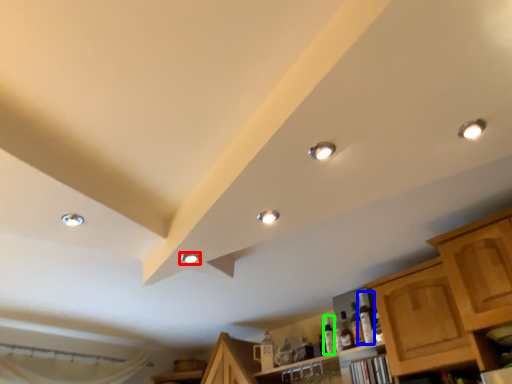
Question: Which object is the farthest from droplight (highlighted by a red box)? Choose among these: bottle (highlighted by a blue box) or bottle (highlighted by a green box).

Choices:
 (A) bottle
 (B) bottle

Answer: (B)